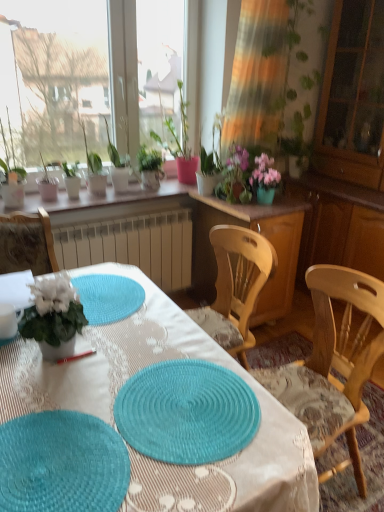
The image size is (384, 512). Find the location of `free space between white matte plant at left, which appears as the second houseplant when viewed from the right, and teal woven placemat at center, arranged as the 1th mat when viewed from the right`. free space between white matte plant at left, which appears as the second houseplant when viewed from the right, and teal woven placemat at center, arranged as the 1th mat when viewed from the right is located at coordinates (113, 376).